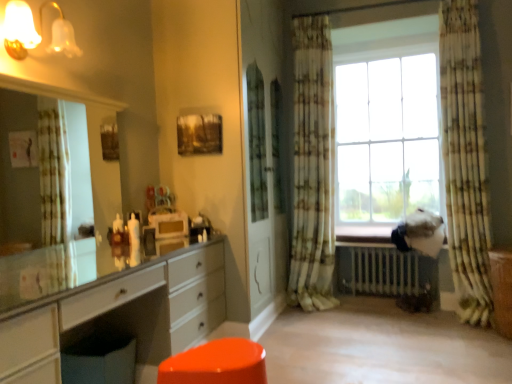
Question: Looking at their shapes, would you say floral fabric curtain at right, the 2th curtain from the left, is wider or thinner than wooden textured picture frame at upper center?

Choices:
 (A) wide
 (B) thin

Answer: (A)

Question: Is floral fabric curtain at right, the first curtain viewed from the right, bigger or smaller than wooden textured picture frame at upper center?

Choices:
 (A) small
 (B) big

Answer: (B)

Question: Based on their relative distances, which object is nearer to the glossy plastic stool at lower center?

Choices:
 (A) white glossy chest of drawers at left
 (B) matte glass sconce at upper left
 (C) brown wood file cabinet at lower right
 (D) patterned fabric curtain at center, acting as the 2th curtain starting from the right
 (E) floral fabric curtain at right, the 2th curtain from the left

Answer: (A)

Question: Estimate the real-world distances between objects in this image. Which object is farther from the brown wood file cabinet at lower right?

Choices:
 (A) white glossy chest of drawers at left
 (B) matte glass sconce at upper left
 (C) metallic silver radiator at lower center
 (D) glossy plastic stool at lower center
 (E) wooden textured picture frame at upper center

Answer: (B)